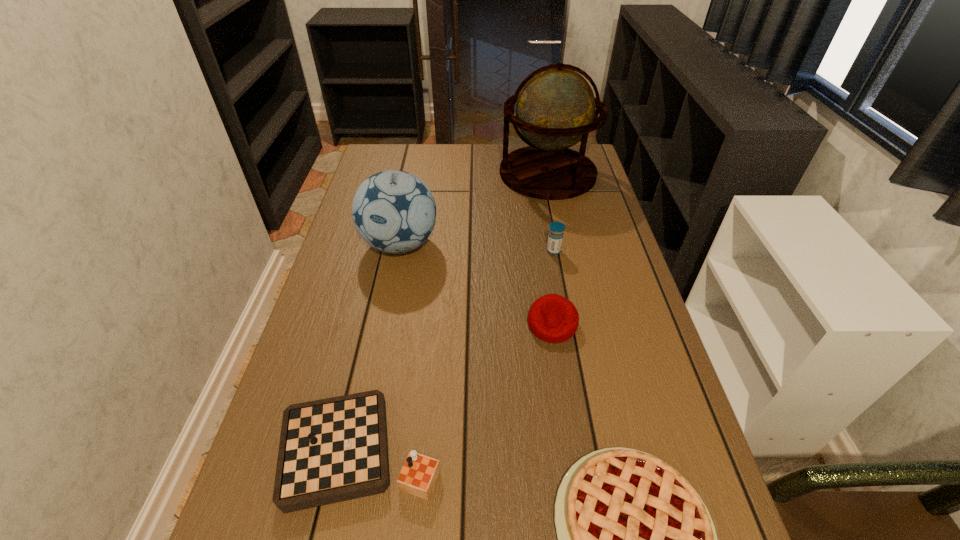
Find the location of a particular element. The height and width of the screenshot is (540, 960). the farthest object is located at coordinates (555, 109).

Locate an element on the screen. This screenshot has width=960, height=540. globe is located at coordinates (555, 109).

Find the location of `the fifth shortest object`. the fifth shortest object is located at coordinates (394, 211).

Identify the location of the fourth shortest object. This screenshot has height=540, width=960. tap(555, 238).

Where is `beanbag`? The height and width of the screenshot is (540, 960). beanbag is located at coordinates (553, 318).

Locate an element on the screen. The image size is (960, 540). chessboard is located at coordinates (331, 450).

At what (x,y) coordinates should I click in order to perform the action: click on free spot located 0.200m on the front-facing side of the globe. Please return your answer as a coordinate pair (x, y). The image size is (960, 540). Looking at the image, I should click on (444, 173).

In order to click on blank area located 0.230m on the front-facing side of the globe in this screenshot , I will do `click(435, 173)`.

Find the location of a particular element. vacant space located 0.050m on the front-facing side of the globe is located at coordinates (486, 173).

Identify the location of vacant space located 0.120m on the side with brand of the soccer ball. The height and width of the screenshot is (540, 960). (388, 303).